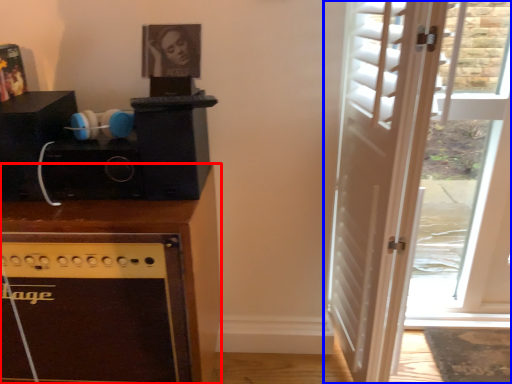
Question: Which of the following is the closest to the observer, cabinetry (highlighted by a red box) or door (highlighted by a blue box)?

Choices:
 (A) cabinetry
 (B) door

Answer: (B)